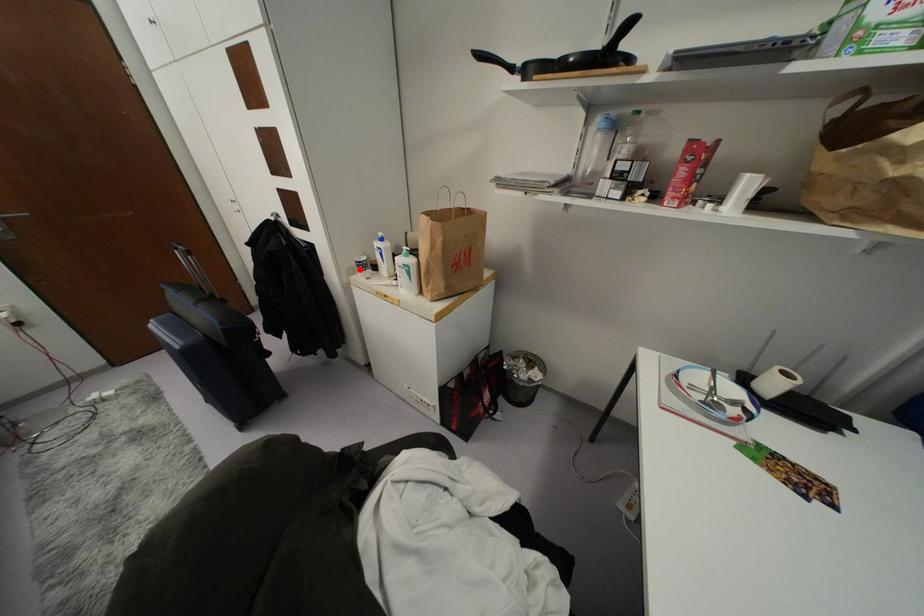
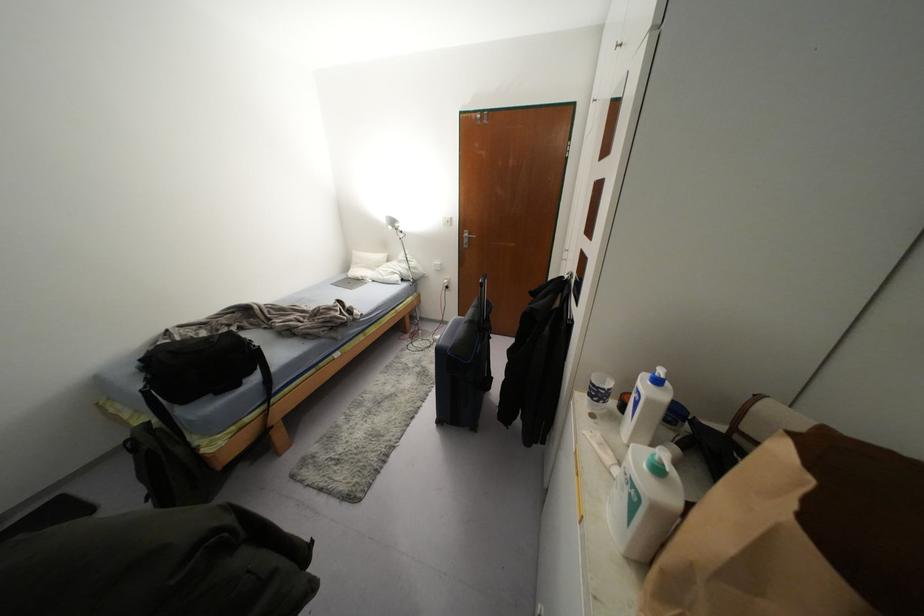
Find the pixel in the second image that matches the highlighted location in the first image.

(590, 395)